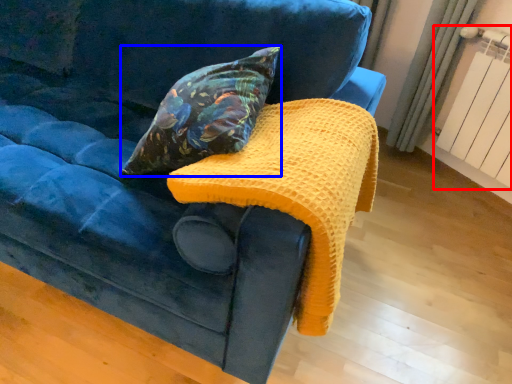
Question: Which object is further to the camera taking this photo, radiator (highlighted by a red box) or pillow (highlighted by a blue box)?

Choices:
 (A) radiator
 (B) pillow

Answer: (A)